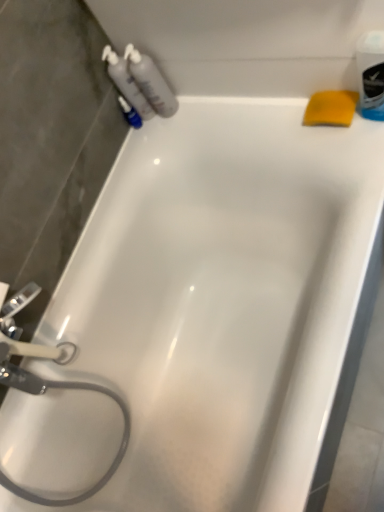
Identify the location of vacant point to the left of blue plastic mouthwash at upper right. This screenshot has height=512, width=384. (342, 159).